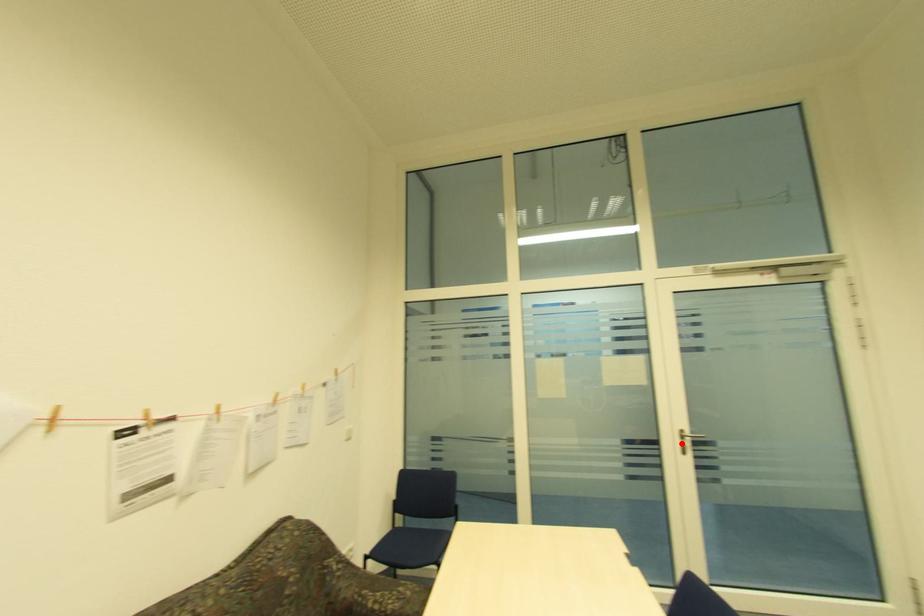
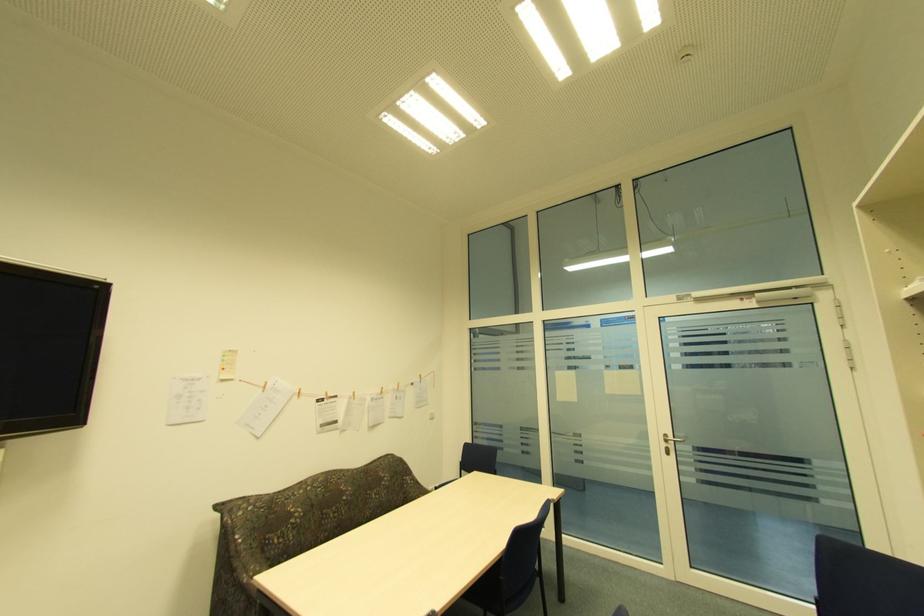
Find the pixel in the second image that matches the highlighted location in the first image.

(666, 445)